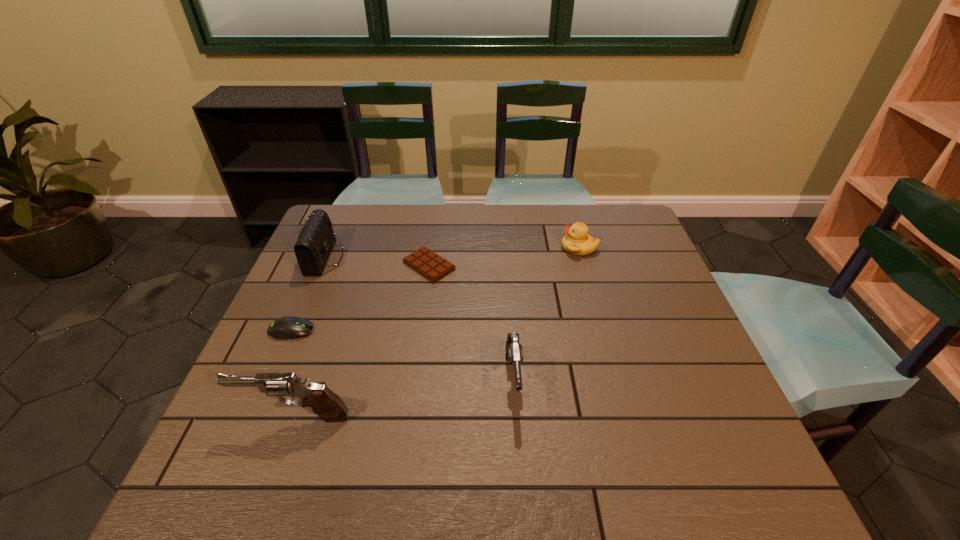
The image size is (960, 540). In order to click on the fourth farthest object in this screenshot , I will do [285, 328].

Where is `vacant region located at the barrel of the right pistol`? vacant region located at the barrel of the right pistol is located at coordinates (517, 441).

Locate an element on the screen. free space located 0.260m on the front of the candy bar is located at coordinates 417,357.

The height and width of the screenshot is (540, 960). Find the location of `blank area located 0.070m on the front flap of the clutch bag`. blank area located 0.070m on the front flap of the clutch bag is located at coordinates point(366,258).

Find the location of `free space located on the front-facing side of the third shortest object`. free space located on the front-facing side of the third shortest object is located at coordinates (541, 248).

Find the location of `free space located 0.110m on the front-facing side of the third shortest object`. free space located 0.110m on the front-facing side of the third shortest object is located at coordinates (x=525, y=248).

Where is `vacant space located on the front-facing side of the third shortest object`? This screenshot has width=960, height=540. vacant space located on the front-facing side of the third shortest object is located at coordinates (516, 248).

Find the location of a particular element. The image size is (960, 540). vacant space situated 0.240m on the wheel side of the computer mouse is located at coordinates (410, 330).

The image size is (960, 540). I want to click on clutch bag situated at the far edge, so click(x=315, y=241).

Where is `duckling located in the far edge section of the desktop`? The width and height of the screenshot is (960, 540). duckling located in the far edge section of the desktop is located at coordinates (577, 241).